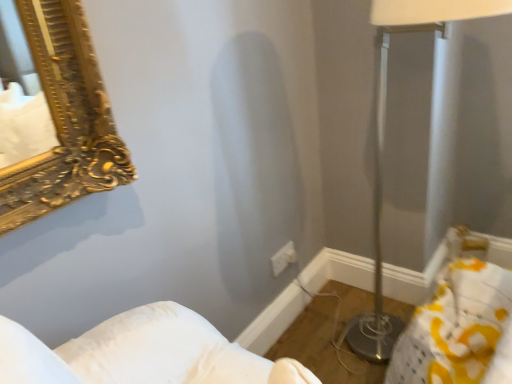
Where is `white plastic electric outlet at center`? Image resolution: width=512 pixels, height=384 pixels. white plastic electric outlet at center is located at coordinates (283, 258).

The width and height of the screenshot is (512, 384). What do you see at coordinates (283, 258) in the screenshot?
I see `white plastic electric outlet at center` at bounding box center [283, 258].

Describe the element at coordinates (383, 141) in the screenshot. Image resolution: width=512 pixels, height=384 pixels. I see `metallic silver table lamp at right` at that location.

Measure the distance between point (503, 0) and camera.

They are 32.44 inches apart.

Locate an element on the screen. This screenshot has height=384, width=512. metallic silver table lamp at right is located at coordinates (x=383, y=141).

Identify the location of white plastic electric outlet at center. (283, 258).

Would you say white plastic electric outlet at center is to the left or to the right of metallic silver table lamp at right in the picture?

white plastic electric outlet at center is positioned on metallic silver table lamp at right's left side.

Which object is further away from the camera, white plastic electric outlet at center or metallic silver table lamp at right?

white plastic electric outlet at center is further from the camera.

Is point (279, 262) closer to viewer compared to point (377, 277)?

Yes, it is in front of point (377, 277).

From the image's perspective, does white plastic electric outlet at center appear lower than metallic silver table lamp at right?

Yes, from the image's perspective, white plastic electric outlet at center is below metallic silver table lamp at right.

From a real-world perspective, who is located lower, white plastic electric outlet at center or metallic silver table lamp at right?

white plastic electric outlet at center.

Looking at their sizes, would you say white plastic electric outlet at center is wider or thinner than metallic silver table lamp at right?

Clearly, white plastic electric outlet at center has less width compared to metallic silver table lamp at right.

Between white plastic electric outlet at center and metallic silver table lamp at right, which one has more height?

metallic silver table lamp at right is taller.

Who is bigger, white plastic electric outlet at center or metallic silver table lamp at right?

metallic silver table lamp at right is bigger.

Consider the image. Is metallic silver table lamp at right a part of white plastic electric outlet at center?

Actually, metallic silver table lamp at right is outside white plastic electric outlet at center.

Would you say white plastic electric outlet at center is a long distance from metallic silver table lamp at right?

No, white plastic electric outlet at center is not far away from metallic silver table lamp at right.

Is white plastic electric outlet at center positioned with its back to metallic silver table lamp at right?

No, white plastic electric outlet at center is not facing away from metallic silver table lamp at right.

Can you tell me how much white plastic electric outlet at center and metallic silver table lamp at right differ in facing direction?

white plastic electric outlet at center and metallic silver table lamp at right are facing 90 degrees away from each other.

How much distance is there between white plastic electric outlet at center and metallic silver table lamp at right?

The distance of white plastic electric outlet at center from metallic silver table lamp at right is 18.86 inches.

Identify the location of table lamp positioned vertically above the white plastic electric outlet at center (from a real-world perspective). (383, 141).

Between metallic silver table lamp at right and white plastic electric outlet at center, which one appears on the left side from the viewer's perspective?

white plastic electric outlet at center is more to the left.

Which object is further away from the camera taking this photo, metallic silver table lamp at right or white plastic electric outlet at center?

Positioned behind is white plastic electric outlet at center.

Considering the positions of point (385, 324) and point (288, 252), is point (385, 324) closer or farther from the camera than point (288, 252)?

Point (385, 324).

From the image's perspective, is metallic silver table lamp at right under white plastic electric outlet at center?

No.

From a real-world perspective, is metallic silver table lamp at right positioned over white plastic electric outlet at center based on gravity?

Yes.

Considering the sizes of metallic silver table lamp at right and white plastic electric outlet at center in the image, is metallic silver table lamp at right wider or thinner than white plastic electric outlet at center?

Considering their sizes, metallic silver table lamp at right looks broader than white plastic electric outlet at center.

Who is taller, metallic silver table lamp at right or white plastic electric outlet at center?

metallic silver table lamp at right is taller.

Who is bigger, metallic silver table lamp at right or white plastic electric outlet at center?

metallic silver table lamp at right.

Based on the photo, is white plastic electric outlet at center surrounded by metallic silver table lamp at right?

No, white plastic electric outlet at center is not surrounded by metallic silver table lamp at right.

In the scene shown: Is metallic silver table lamp at right next to white plastic electric outlet at center?

There is a gap between metallic silver table lamp at right and white plastic electric outlet at center.

Is metallic silver table lamp at right facing towards white plastic electric outlet at center?

No, metallic silver table lamp at right does not turn towards white plastic electric outlet at center.

You are a GUI agent. You are given a task and a screenshot of the screen. Output one action in this format:
    pyautogui.click(x=<x>, y=<y>)
    Task: Click on the electric outlet that is behind the metallic silver table lamp at right
    Image resolution: width=512 pixels, height=384 pixels.
    Given the screenshot: What is the action you would take?
    click(x=283, y=258)

Find the location of a particular element. The width and height of the screenshot is (512, 384). table lamp above the white plastic electric outlet at center (from the image's perspective) is located at coordinates (383, 141).

Where is `electric outlet that is on the left side of metallic silver table lamp at right`? This screenshot has width=512, height=384. electric outlet that is on the left side of metallic silver table lamp at right is located at coordinates (283, 258).